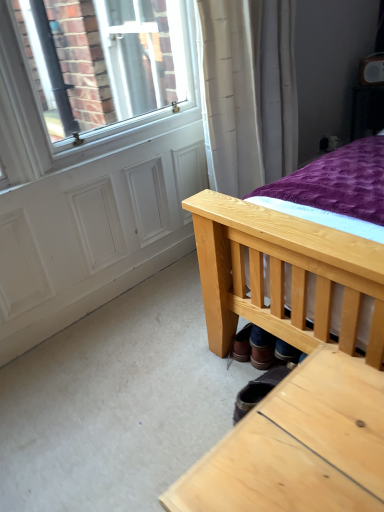
At what (x,y) coordinates should I click in order to perform the action: click on free point above light wood table at lower right (from a real-world perspective). Please return your answer as a coordinate pair (x, y). Looking at the image, I should click on (309, 441).